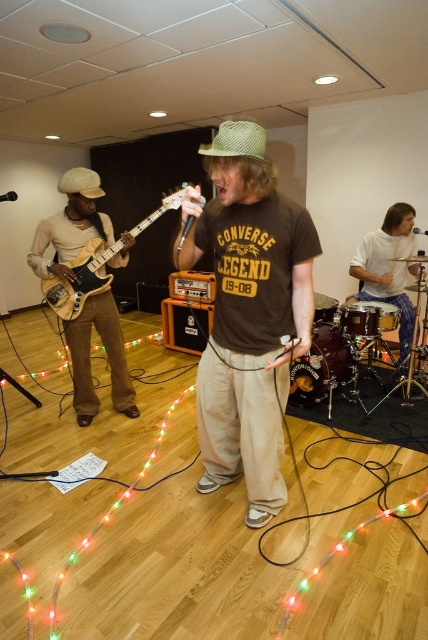
Based on the photo, between matte wood guitar at left and matte wood electric guitar at left, which one appears on the left side from the viewer's perspective?

From the viewer's perspective, matte wood guitar at left appears more on the left side.

Which is below, matte wood guitar at left or matte wood electric guitar at left?

matte wood guitar at left

You are a GUI agent. You are given a task and a screenshot of the screen. Output one action in this format:
    pyautogui.click(x=<x>, y=<y>)
    Task: Click on the matte wood guitar at left
    Image resolution: width=428 pixels, height=640 pixels.
    Given the screenshot: What is the action you would take?
    pyautogui.click(x=107, y=356)

The image size is (428, 640). In order to click on matte wood guitar at left in this screenshot , I will do `click(107, 356)`.

Which is in front, point (113, 362) or point (383, 225)?

Positioned in front is point (113, 362).

Which is below, matte wood guitar at left or white fabric drum at right?

matte wood guitar at left is lower down.

You are a GUI agent. You are given a task and a screenshot of the screen. Output one action in this format:
    pyautogui.click(x=<x>, y=<y>)
    Task: Click on the matte wood guitar at left
    The height and width of the screenshot is (640, 428).
    Given the screenshot: What is the action you would take?
    pyautogui.click(x=107, y=356)

Image resolution: width=428 pixels, height=640 pixels. Identify the location of matte wood guitar at left. (107, 356).

Which is above, matte wood electric guitar at left or shiny black drum set at center?

matte wood electric guitar at left is higher up.

The height and width of the screenshot is (640, 428). Describe the element at coordinates (82, 278) in the screenshot. I see `matte wood electric guitar at left` at that location.

Who is more distant from viewer, (142,221) or (303,397)?

The point (303,397) is behind.

This screenshot has width=428, height=640. Find the location of `matte wood electric guitar at left`. matte wood electric guitar at left is located at coordinates (82, 278).